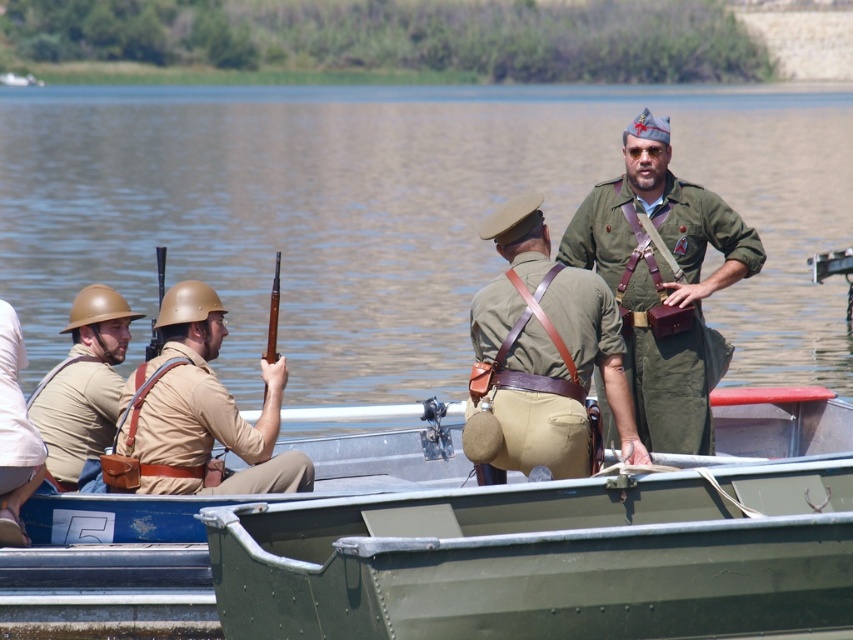
Question: Which point appears farthest from the camera in this image?

Choices:
 (A) (15, 408)
 (B) (425, 381)
 (C) (622, 390)

Answer: (B)

Question: Which point is farther to the camera?

Choices:
 (A) (498, 288)
 (B) (91, 406)

Answer: (B)

Question: Is green metal boat at center above tan leather helmet at left?

Choices:
 (A) no
 (B) yes

Answer: (A)

Question: Does green water at center have a larger size compared to khaki uniform at left?

Choices:
 (A) yes
 (B) no

Answer: (A)

Question: Among these objects, which one is farthest from the camera?

Choices:
 (A) green metal boat at center
 (B) tan leather uniform at left

Answer: (B)

Question: In this image, where is matte olive-green uniform at center located relative to khaki uniform at left?

Choices:
 (A) above
 (B) below

Answer: (A)